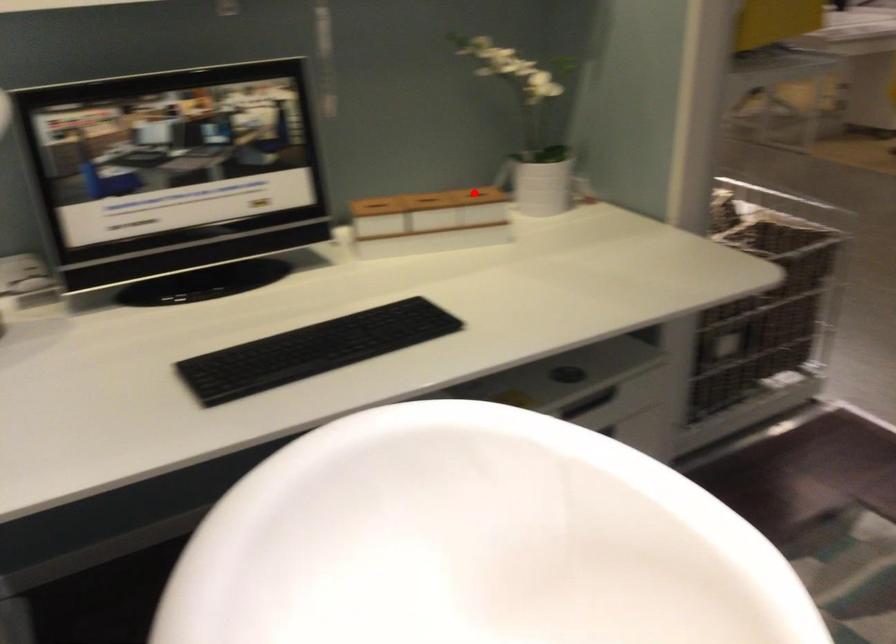
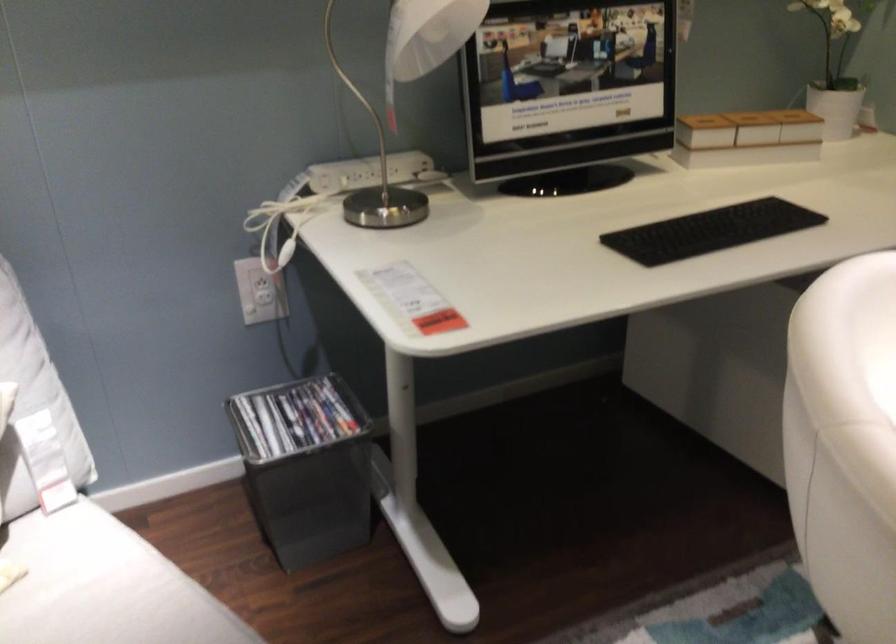
Locate, in the second image, the point that corresponds to the highlighted location in the first image.

(799, 109)